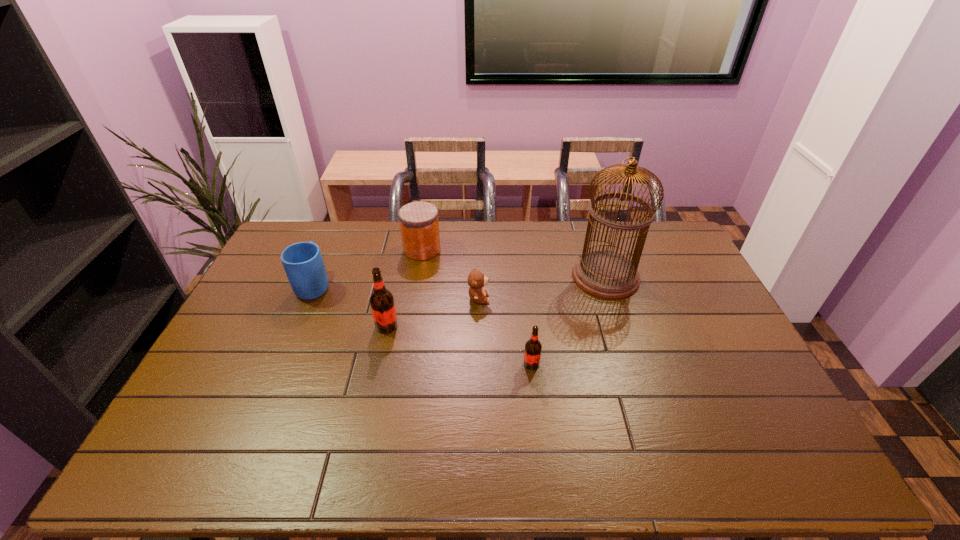
Locate an element on the screen. the farther root beer is located at coordinates (382, 303).

You are a GUI agent. You are given a task and a screenshot of the screen. Output one action in this format:
    pyautogui.click(x=<x>, y=<y>)
    Task: Click on the taller root beer
    This screenshot has width=960, height=540.
    Given the screenshot: What is the action you would take?
    pyautogui.click(x=382, y=303)

You are a GUI agent. You are given a task and a screenshot of the screen. Output one action in this format:
    pyautogui.click(x=<x>, y=<y>)
    Task: Click on the nearer root beer
    The height and width of the screenshot is (540, 960).
    Given the screenshot: What is the action you would take?
    pyautogui.click(x=532, y=354)

Locate an element on the screen. This screenshot has height=540, width=960. the nearest object is located at coordinates (532, 354).

Find the location of a particular element. The image size is (960, 540). the rightmost object is located at coordinates (605, 274).

In order to click on the tallest object in this screenshot , I will do `click(605, 274)`.

At what (x,y) coordinates should I click in order to perform the action: click on jar. Please return your answer as a coordinate pair (x, y). Looking at the image, I should click on (419, 223).

In order to click on mug in this screenshot , I will do `click(303, 263)`.

Locate an element on the screen. This screenshot has width=960, height=540. the shortest object is located at coordinates (476, 280).

Where is `the fourth object from left to right`? the fourth object from left to right is located at coordinates (476, 280).